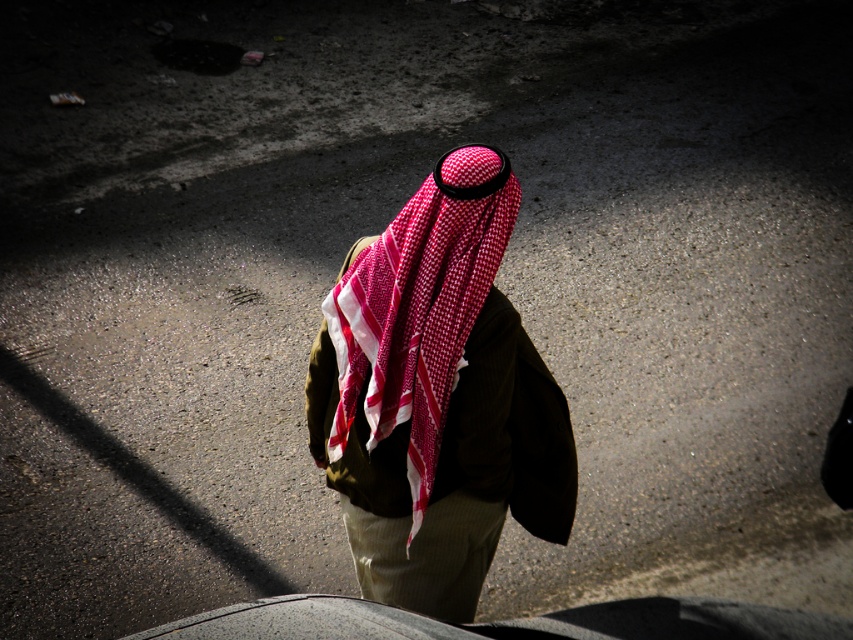
Question: Does red checkered headscarf at center have a lesser width compared to khaki fabric at center?

Choices:
 (A) yes
 (B) no

Answer: (B)

Question: Is red checkered headscarf at center bigger than khaki fabric at center?

Choices:
 (A) yes
 (B) no

Answer: (A)

Question: Can you confirm if red checkered headscarf at center is positioned to the left of khaki fabric at center?

Choices:
 (A) yes
 (B) no

Answer: (B)

Question: Which point is farther to the camera?

Choices:
 (A) red checkered headscarf at center
 (B) khaki fabric at center

Answer: (B)

Question: Which point appears closest to the camera in this image?

Choices:
 (A) (463, 497)
 (B) (438, 464)

Answer: (B)